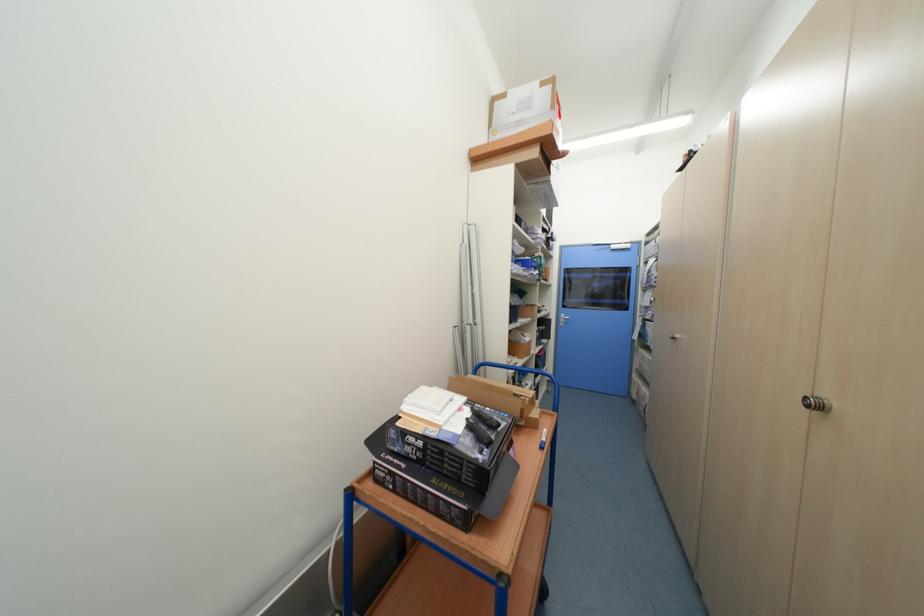
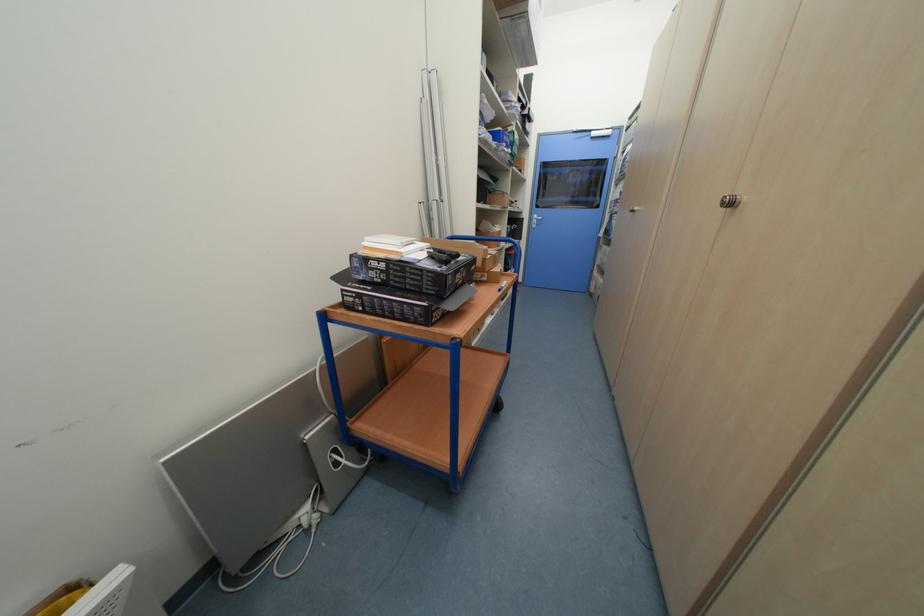
Locate, in the second image, the point that corresponds to point (813, 408) in the first image.

(728, 206)